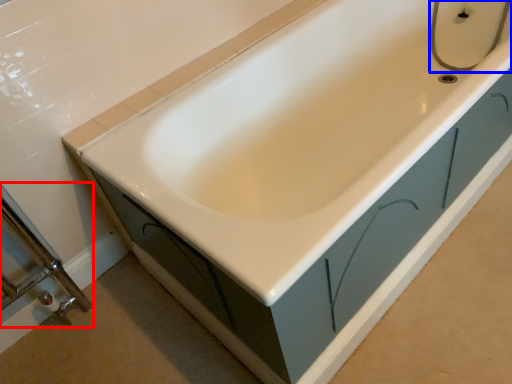
Question: Which object is further to the camera taking this photo, shower door (highlighted by a red box) or plumbing fixture (highlighted by a blue box)?

Choices:
 (A) shower door
 (B) plumbing fixture

Answer: (B)